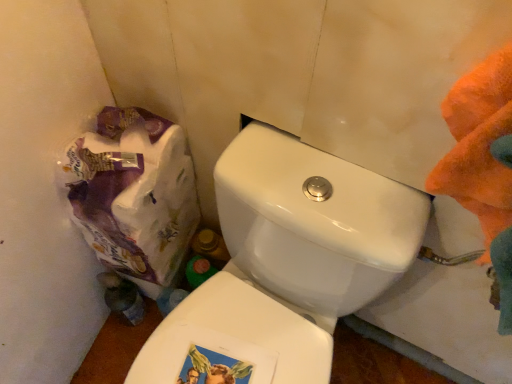
The image size is (512, 384). Identify the location of blank space situated above white paper bag at lower left (from a real-world perspective). (125, 148).